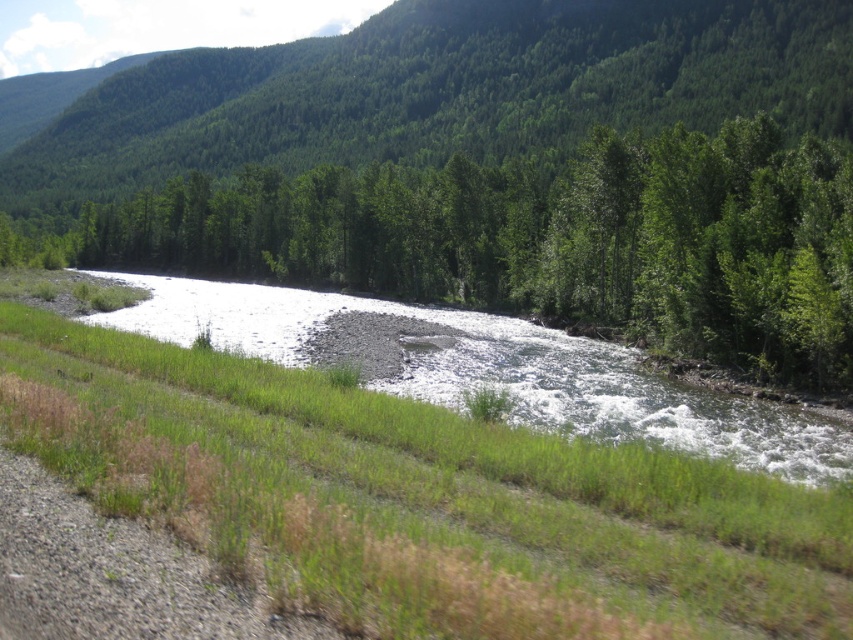
Is point (428, 259) farther from camera compared to point (639, 435)?

Yes, it is behind point (639, 435).

Between green leafy tree at center and white gravel river at center, which one is positioned higher?

Positioned higher is green leafy tree at center.

Where is `green leafy tree at center`? The height and width of the screenshot is (640, 853). green leafy tree at center is located at coordinates (546, 241).

Find the location of a particular element. green leafy tree at center is located at coordinates (546, 241).

Can you confirm if green leafy tree at upper center is positioned to the right of white gravel river at center?

No, green leafy tree at upper center is not to the right of white gravel river at center.

Does green leafy tree at upper center appear over white gravel river at center?

Yes, green leafy tree at upper center is above white gravel river at center.

Is point (117, 76) farther from camera compared to point (490, 330)?

Yes, point (117, 76) is farther from viewer.

You are a GUI agent. You are given a task and a screenshot of the screen. Output one action in this format:
    pyautogui.click(x=<x>, y=<y>)
    Task: Click on the green leafy tree at upper center
    The width and height of the screenshot is (853, 640).
    Given the screenshot: What is the action you would take?
    pyautogui.click(x=444, y=90)

Where is `green leafy tree at center`? The width and height of the screenshot is (853, 640). green leafy tree at center is located at coordinates click(546, 241).

Does point (711, 170) come behind point (428, 17)?

No.

Which is behind, point (194, 257) or point (625, 61)?

Positioned behind is point (625, 61).

Where is `green leafy tree at center`? Image resolution: width=853 pixels, height=640 pixels. green leafy tree at center is located at coordinates 546,241.